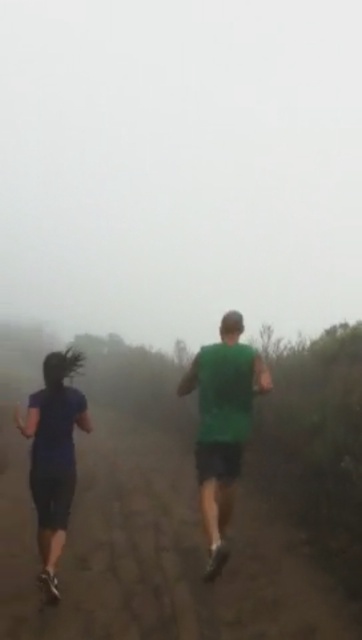
Does green matte tank top at center appear over dark blue fabric at left?

Incorrect, green matte tank top at center is not positioned above dark blue fabric at left.

Can you confirm if green matte tank top at center is positioned to the left of dark blue fabric at left?

In fact, green matte tank top at center is to the right of dark blue fabric at left.

Is point (229, 449) behind point (56, 500)?

Yes, point (229, 449) is farther from viewer.

Locate an element on the screen. green matte tank top at center is located at coordinates (222, 424).